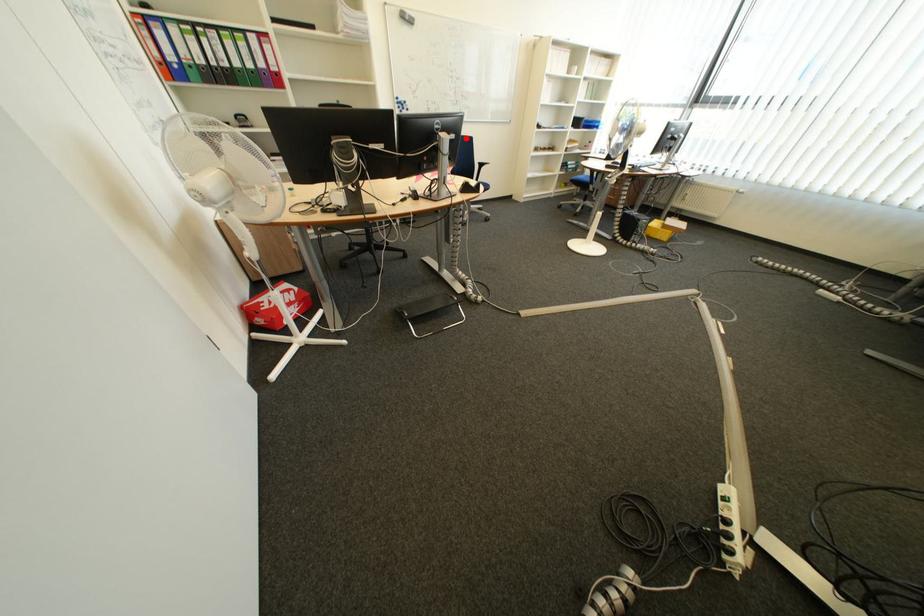
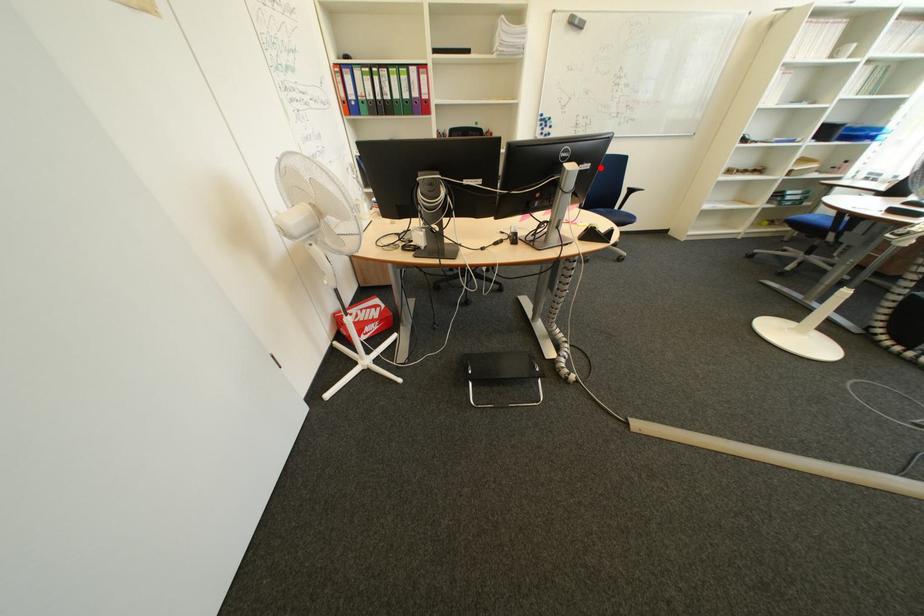
I am providing you with two images of the same scene from different viewpoints. A red point is marked on the first image and another point is marked on the second image. Does the point marked in image1 correspond to the same location as the one in image2?

Yes